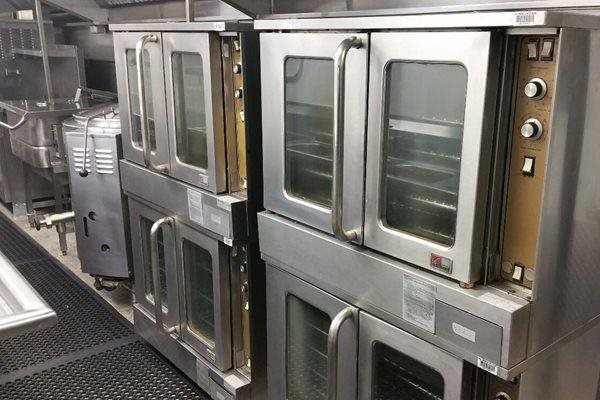
Where is `oven doors`? oven doors is located at coordinates (374, 156), (355, 151), (363, 358), (348, 358), (180, 258), (174, 262), (171, 142), (160, 134).